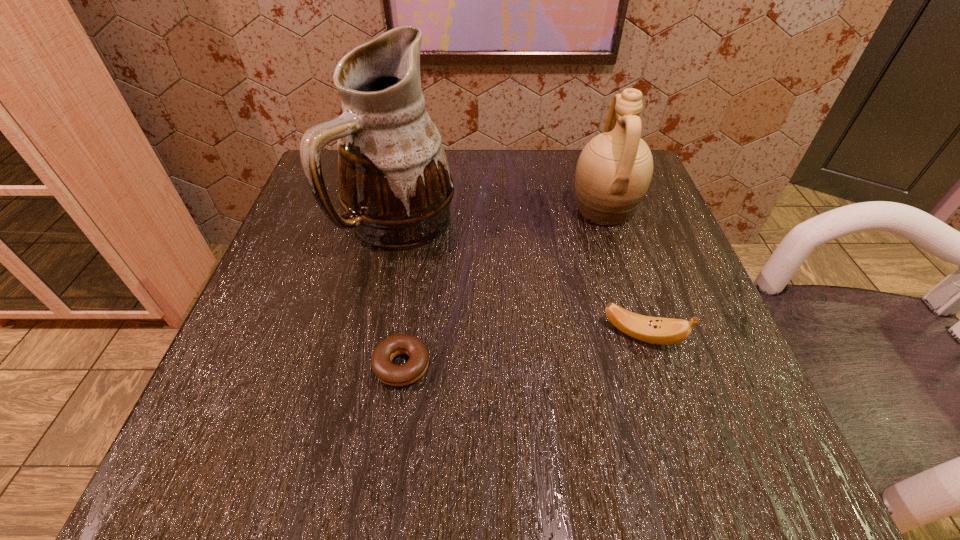
What are the coordinates of `the tallest object` in the screenshot? It's located at (395, 185).

Locate an element on the screen. The height and width of the screenshot is (540, 960). the taller pitcher is located at coordinates (395, 185).

The width and height of the screenshot is (960, 540). What are the coordinates of `the shorter pitcher` in the screenshot? It's located at (614, 170).

At what (x,y) coordinates should I click in order to perform the action: click on the right pitcher. Please return your answer as a coordinate pair (x, y). Looking at the image, I should click on (614, 170).

I want to click on banana, so click(663, 331).

You are a GUI agent. You are given a task and a screenshot of the screen. Output one action in this format:
    pyautogui.click(x=<x>, y=<y>)
    Task: Click on the shortest object
    Image resolution: width=960 pixels, height=540 pixels.
    Given the screenshot: What is the action you would take?
    pyautogui.click(x=391, y=374)

The width and height of the screenshot is (960, 540). Identify the location of vacant space located 0.320m from the spout of the tallest object. (357, 443).

Locate an element on the screen. Image resolution: width=960 pixels, height=540 pixels. vacant space located on the front of the third shortest object is located at coordinates (656, 373).

Identify the location of free space located 0.110m on the front of the banana. Image resolution: width=960 pixels, height=540 pixels. (668, 423).

This screenshot has width=960, height=540. I want to click on free space located 0.050m on the left of the doughnut, so click(339, 366).